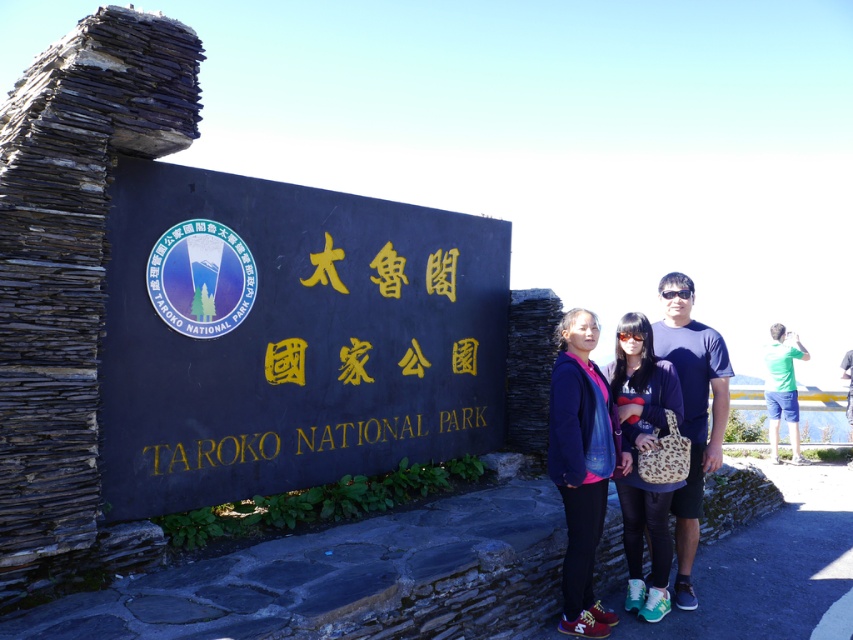
You are a photographer trying to capture a photo of the group standing at the entrance of Taroko National Park. You want to ensure that the black stone sign at center and the matte black shirt at center are both visible in the frame. Based on their positions, which object should be closer to the left side of the photo?

The black stone sign at center is to the left of matte black shirt at center, so the black stone sign at center should be closer to the left side of the photo.

You are a photographer trying to capture a photo of the black stone sign at center and the matte black shirt at center. Which object should you focus on first if you want to ensure both are in sharp focus?

The black stone sign at center is bigger than matte black shirt at center. Since the black stone sign at center is larger, it requires more detailed focus. However, to ensure both are in sharp focus, you should focus on the matte black shirt at center first because it is closer to the camera, allowing the depth of field to cover the farther black stone sign at center.